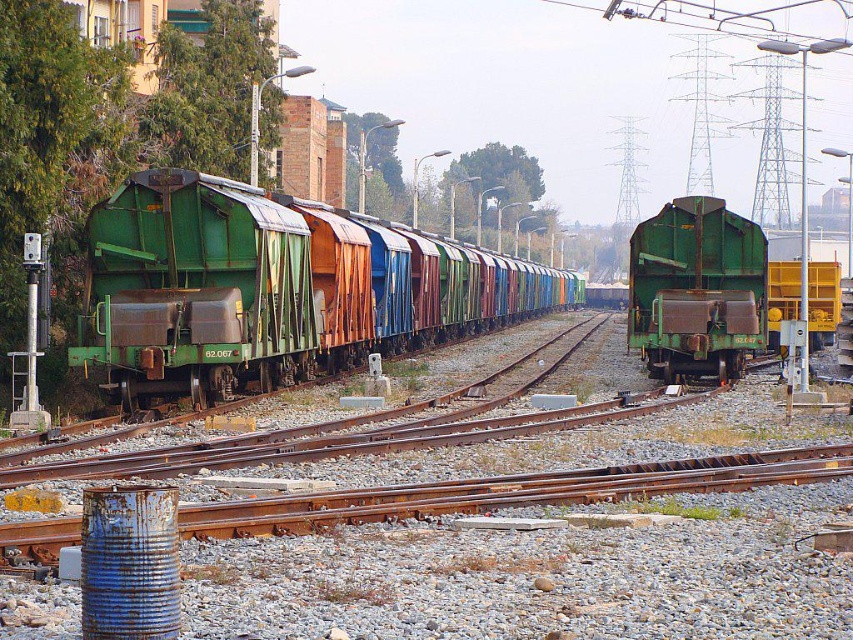
You are a railway worker standing at the edge of the tracks. You see the green matte train carriages at center and the green matte train car at center. Which one is positioned to the left?

The green matte train carriages at center is positioned to the left of the green matte train car at center.

You are a railway inspector checking the spacing between the green matte train carriages at center and the green matte train car at center. According to safety regulations, the minimum required distance between two adjacent train cars is 35 feet. Is the current spacing compliant with the regulations?

The green matte train carriages at center and green matte train car at center are 37.91 feet apart from each other, which exceeds the minimum required distance of 35 feet. Therefore, the current spacing is compliant with the safety regulations.